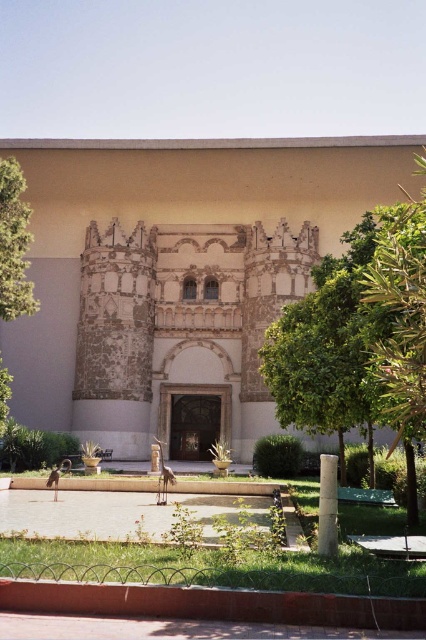
Is point (265, 252) farther from viewer compared to point (400, 356)?

Yes, point (265, 252) is farther from viewer.

Image resolution: width=426 pixels, height=640 pixels. What do you see at coordinates (175, 272) in the screenshot?
I see `stone mosaic palace at center` at bounding box center [175, 272].

This screenshot has width=426, height=640. In order to click on stone mosaic palace at center in this screenshot , I will do `click(175, 272)`.

Is green leafy tree at right further to the viewer compared to green leafy tree at left?

No, green leafy tree at right is closer to the viewer.

Which is behind, point (422, 296) or point (3, 316)?

Positioned behind is point (3, 316).

Locate an element on the screen. The image size is (426, 640). green leafy tree at right is located at coordinates (400, 326).

Does point (310, 432) lie behind point (385, 372)?

Yes, point (310, 432) is farther from viewer.

Is green leafy tree at center taller than green leafy tree at right?

In fact, green leafy tree at center may be shorter than green leafy tree at right.

You are a GUI agent. You are given a task and a screenshot of the screen. Output one action in this format:
    pyautogui.click(x=<x>, y=<y>)
    Task: Click on the green leafy tree at center
    Image resolution: width=426 pixels, height=640 pixels.
    Given the screenshot: What is the action you would take?
    354,333

Where is `green leafy tree at center`? green leafy tree at center is located at coordinates (354, 333).